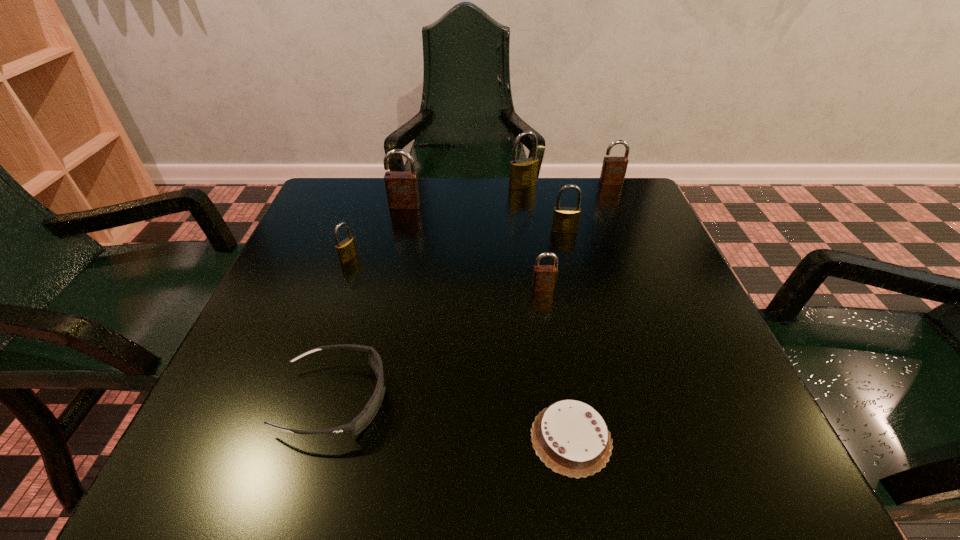
Find the location of `vacant space at the far edge`. vacant space at the far edge is located at coordinates (546, 190).

In order to click on vacant space at the near edge of the desktop in this screenshot , I will do `click(488, 423)`.

Locate an element on the screen. Image resolution: width=960 pixels, height=540 pixels. free spot at the left edge of the desktop is located at coordinates (328, 249).

This screenshot has width=960, height=540. Find the location of `free spot at the right edge of the desktop`. free spot at the right edge of the desktop is located at coordinates (634, 246).

The height and width of the screenshot is (540, 960). In the image, there is a desktop. Identify the location of blank space at the far left corner. (358, 227).

The height and width of the screenshot is (540, 960). In the image, there is a desktop. What are the coordinates of `vacant area at the far right corner` in the screenshot? It's located at (592, 230).

Locate an element on the screen. The width and height of the screenshot is (960, 540). empty space that is in between the sixth nearest object and the second nearest brass padlock is located at coordinates (485, 218).

Where is `blank region between the second biggest brown padlock and the nearest padlock`? The width and height of the screenshot is (960, 540). blank region between the second biggest brown padlock and the nearest padlock is located at coordinates (577, 235).

Locate an element on the screen. The width and height of the screenshot is (960, 540). empty space between the second farthest brown padlock and the biggest brass padlock is located at coordinates (464, 195).

What are the coordinates of `free space that is in between the rightmost brass padlock and the nearest padlock` in the screenshot? It's located at (554, 259).